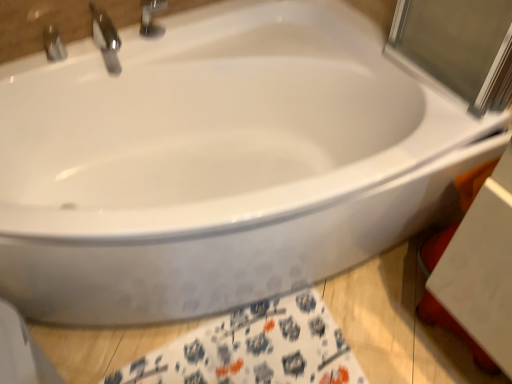
Question: From their relative heights in the image, would you say metallic silver faucet at upper left, the first tap positioned from the left, is taller or shorter than white fabric towel at lower center?

Choices:
 (A) tall
 (B) short

Answer: (A)

Question: Considering the positions of point (52, 34) and point (156, 354), is point (52, 34) closer or farther from the camera than point (156, 354)?

Choices:
 (A) closer
 (B) farther

Answer: (B)

Question: Which of these objects is positioned farthest from the metallic silver faucet at upper left, the first tap positioned from the left?

Choices:
 (A) polished chrome faucet at upper left, the 1th tap positioned from the right
 (B) white fabric towel at lower center

Answer: (B)

Question: Estimate the real-world distances between objects in this image. Which object is closer to the metallic silver faucet at upper left, which is the second tap from right to left?

Choices:
 (A) white fabric towel at lower center
 (B) polished chrome faucet at upper left, placed as the second tap when sorted from left to right

Answer: (B)